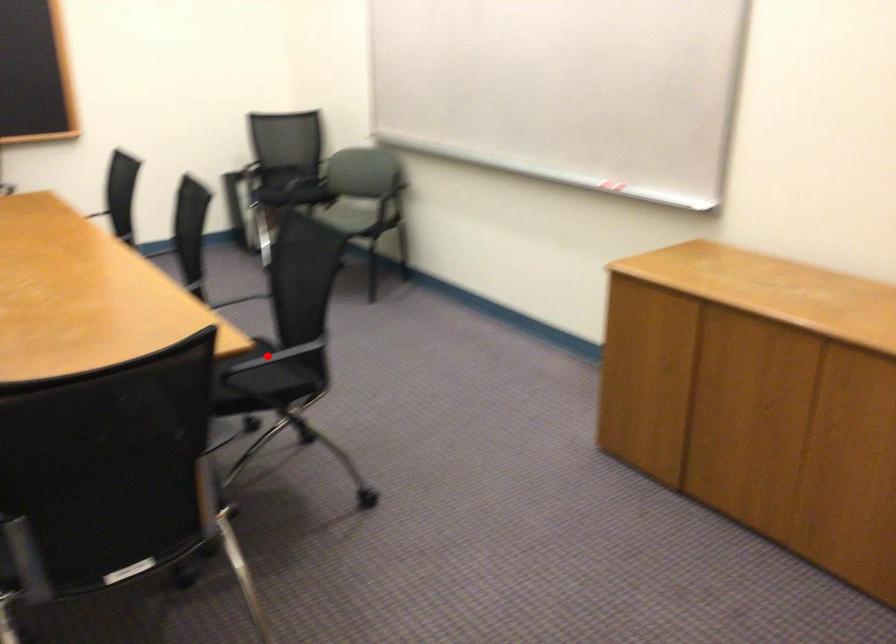
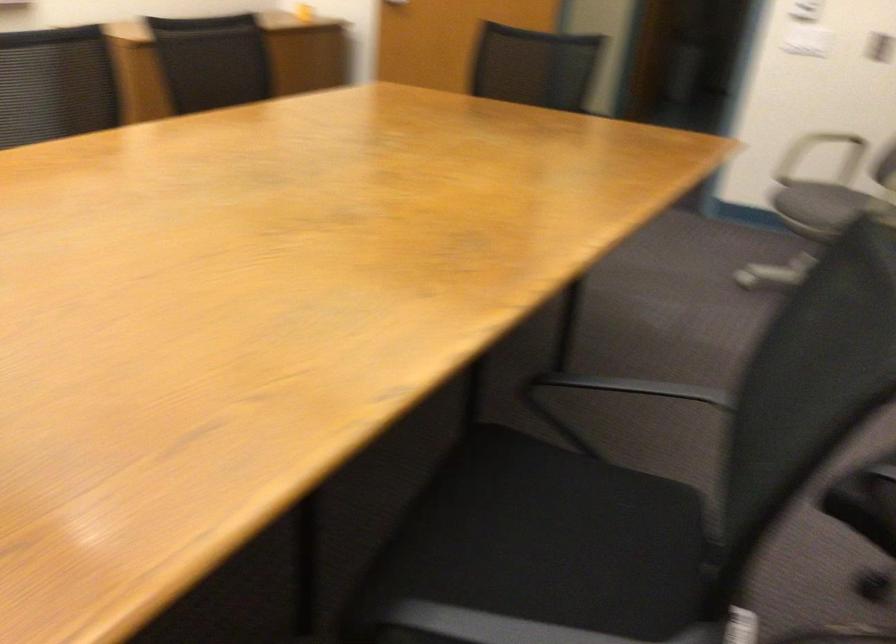
Question: I am providing you with two images of the same scene from different viewpoints. A red point is marked on the first image. Can you still see the location of the red point in image 2?

Choices:
 (A) Yes
 (B) No

Answer: (B)